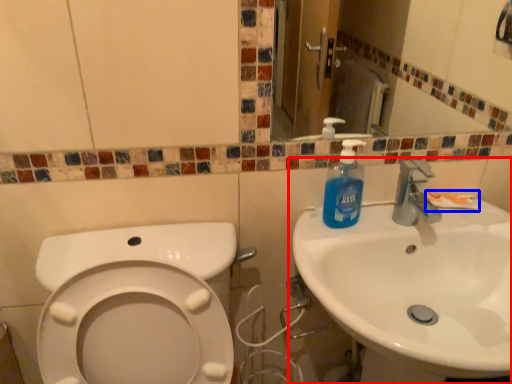
Question: Which object is closer to the camera taking this photo, sink (highlighted by a red box) or toothpaste (highlighted by a blue box)?

Choices:
 (A) sink
 (B) toothpaste

Answer: (A)